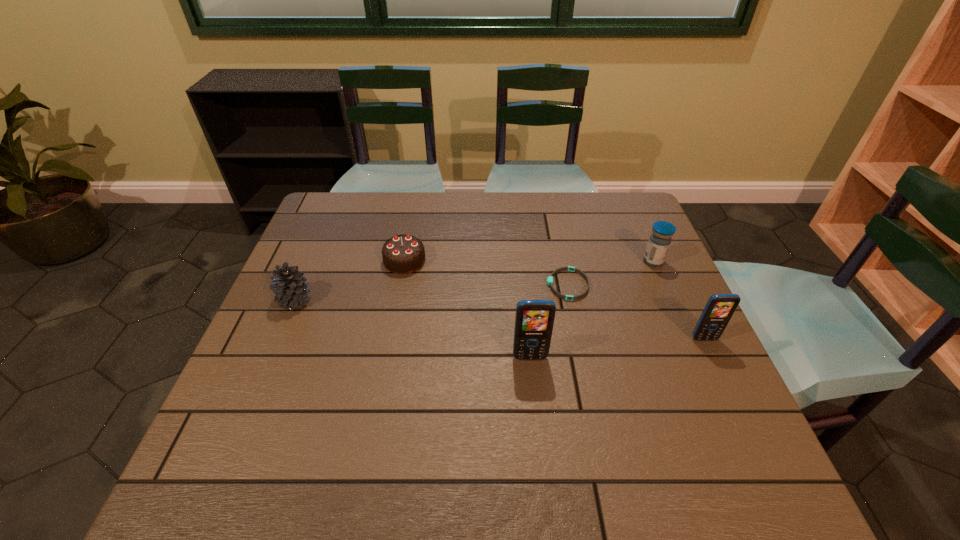
What are the coordinates of `free space located on the screen of the tallest object` in the screenshot? It's located at 533,389.

You are a GUI agent. You are given a task and a screenshot of the screen. Output one action in this format:
    pyautogui.click(x=<x>, y=<y>)
    Task: Click on the free region located 0.190m on the screen of the right cellular telephone
    
    Given the screenshot: What is the action you would take?
    pyautogui.click(x=740, y=416)

Locate an element on the screen. This screenshot has width=960, height=540. free spot located on the right of the fifth object from right to left is located at coordinates (531, 260).

Where is `vacant space located on the front of the medicine`? vacant space located on the front of the medicine is located at coordinates point(674,310).

Where is `vacant space located on the buckle of the shortest object`? vacant space located on the buckle of the shortest object is located at coordinates coord(454,285).

This screenshot has width=960, height=540. Identify the location of vacant space located on the buckle of the shortest object. (443, 285).

This screenshot has height=540, width=960. Identify the location of vacant space located 0.340m on the buckle of the shortest object. (420, 285).

Image resolution: width=960 pixels, height=540 pixels. Identify the location of vacant region located on the right of the pinecone. (405, 301).

Where is `object that is at the left edge`? The image size is (960, 540). object that is at the left edge is located at coordinates (288, 284).

This screenshot has width=960, height=540. In order to click on cellular telephone located in the right edge section of the desktop in this screenshot , I will do 719,309.